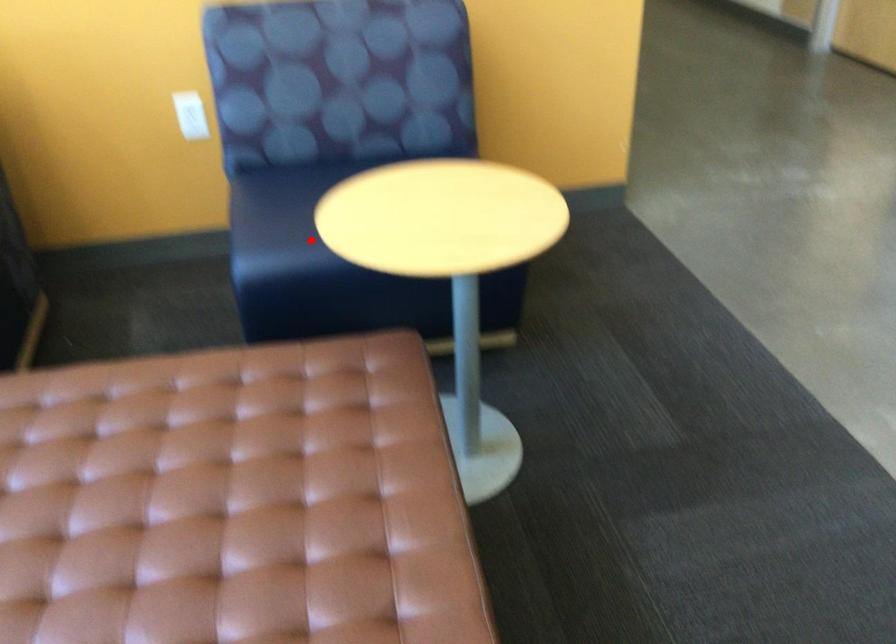
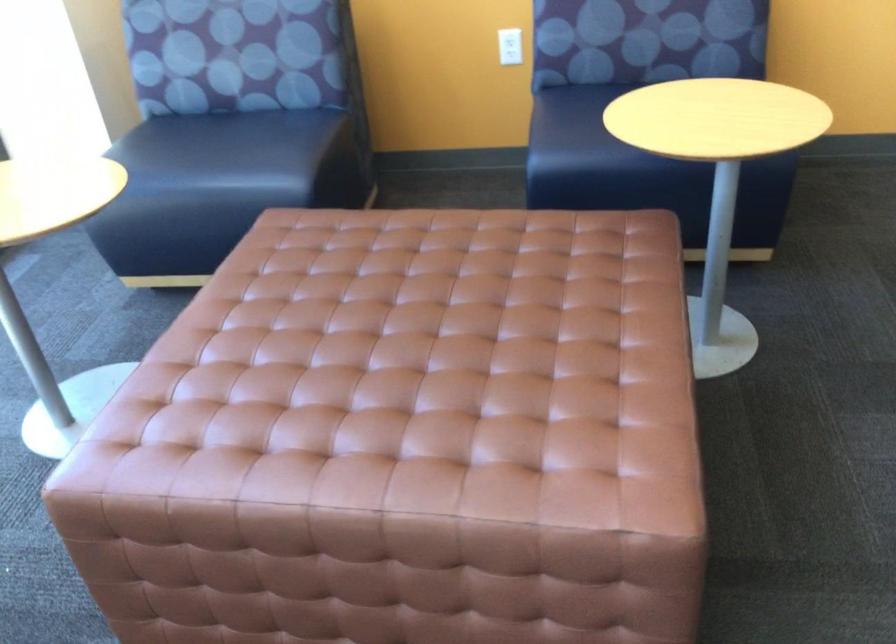
Question: A red point is marked in image1. In image2, is the corresponding 3D point closer to the camera or farther? Reply with the corresponding letter.

Choices:
 (A) The corresponding 3D point is closer.
 (B) The corresponding 3D point is farther.

Answer: (B)